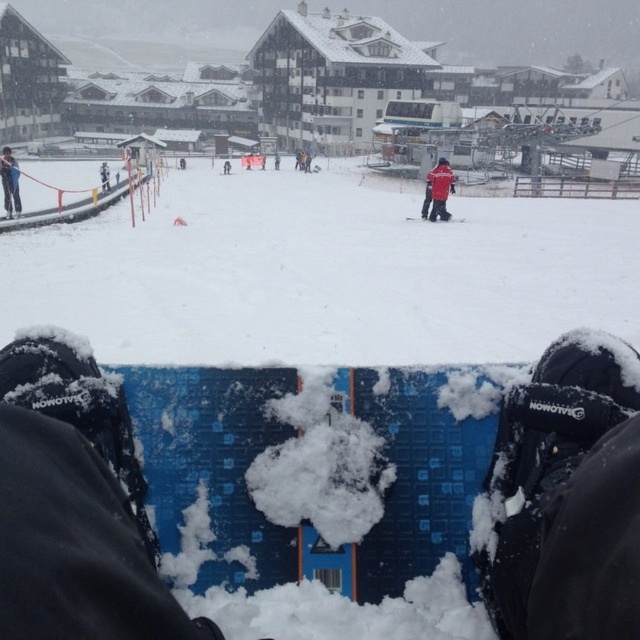
You are a photographer trying to capture both the red matte jacket at center and the dark blue snowboard at left in a single shot. Given their sizes, which object might appear closer to the camera in the photo?

The red matte jacket at center appears larger in size than the dark blue snowboard at left, so it might appear closer to the camera in the photo.

You are standing at the point closer to the viewer between the two points, point (444, 195) and point (10, 204). You want to move towards the snowboard in the foreground. Which direction should you go?

Since point (444, 195) is closer to the viewer than point (10, 204), you are already at the point closer to the snowboard in the foreground. Therefore, you don not need to move further. However, if you want to move towards the snowboard, you should move forward towards the foreground.